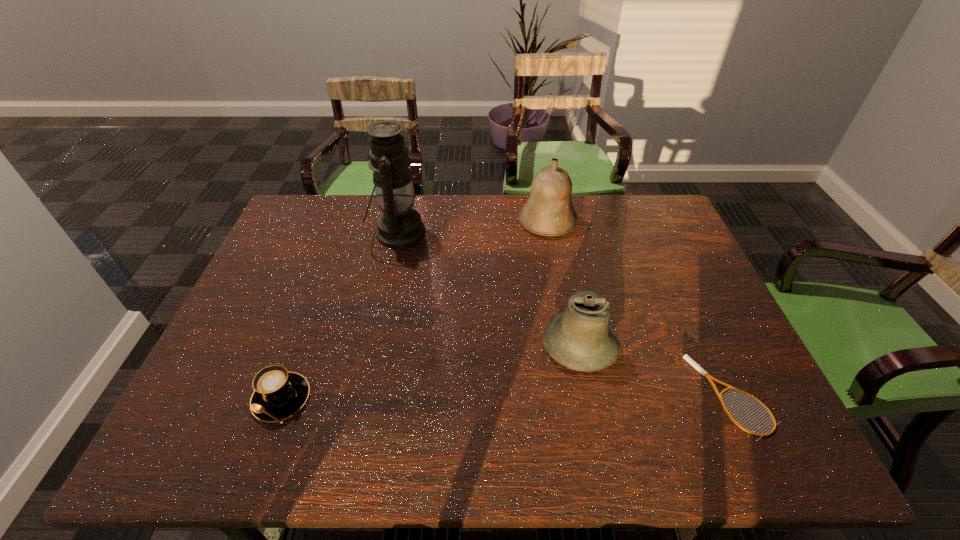
At what (x,y) coordinates should I click in order to perform the action: click on free space between the tallest object and the taller bell. Please return your answer as a coordinate pair (x, y). The width and height of the screenshot is (960, 540). Looking at the image, I should click on (472, 227).

Where is `free space between the third shortest object and the taller bell`? Image resolution: width=960 pixels, height=540 pixels. free space between the third shortest object and the taller bell is located at coordinates (564, 284).

In order to click on empty space between the tennis racket and the third shortest object in this screenshot , I will do `click(656, 370)`.

Find the location of a particular element. The width and height of the screenshot is (960, 540). vacant area that lies between the third tallest object and the fourth tallest object is located at coordinates (430, 372).

Where is `free area in between the second shortest object and the farther bell`? The width and height of the screenshot is (960, 540). free area in between the second shortest object and the farther bell is located at coordinates (414, 310).

Where is `empty location between the shortest object and the taller bell`? The height and width of the screenshot is (540, 960). empty location between the shortest object and the taller bell is located at coordinates (639, 309).

Identify the location of empty location between the cappuccino and the third shortest object. (430, 372).

This screenshot has width=960, height=540. Identify the location of empty location between the taller bell and the tennis racket. click(x=639, y=309).

Identify the location of vacant region between the fourth object from right to left and the leftmost object. The width and height of the screenshot is (960, 540). (340, 316).

Identify which object is the closest to the rightmost object. Please provide its 2D coordinates. Your answer should be formatted as a tuple, i.e. [(x, y)], where the tuple contains the x and y coordinates of a point satisfying the conditions above.

[(581, 338)]